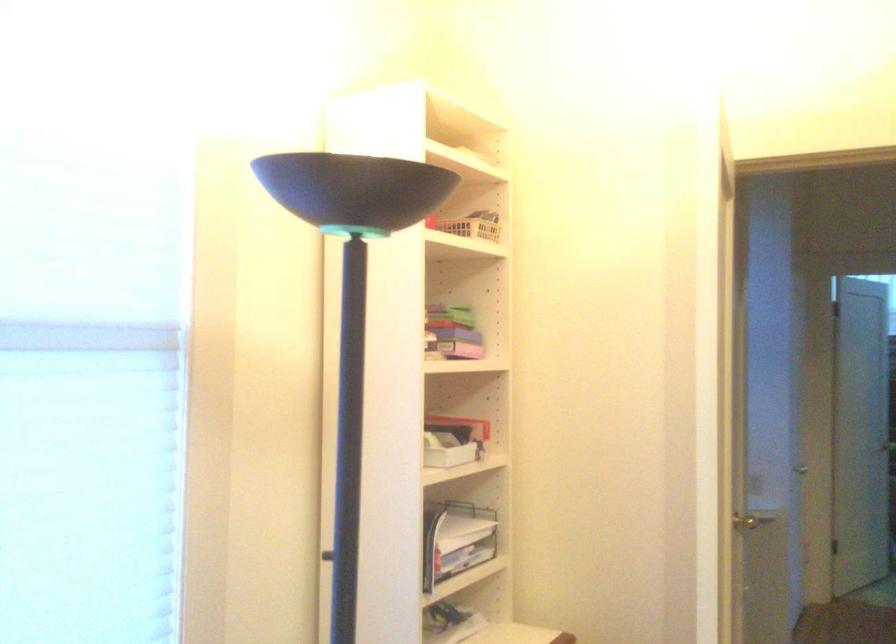
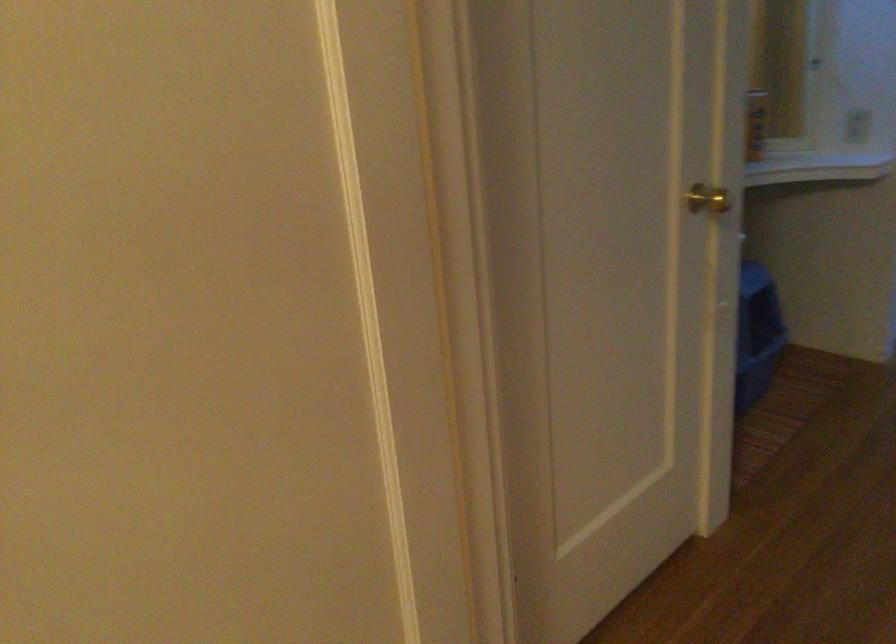
The images are taken continuously from a first-person perspective. In which direction are you moving?

The movement direction of the cameraman is right, forward.